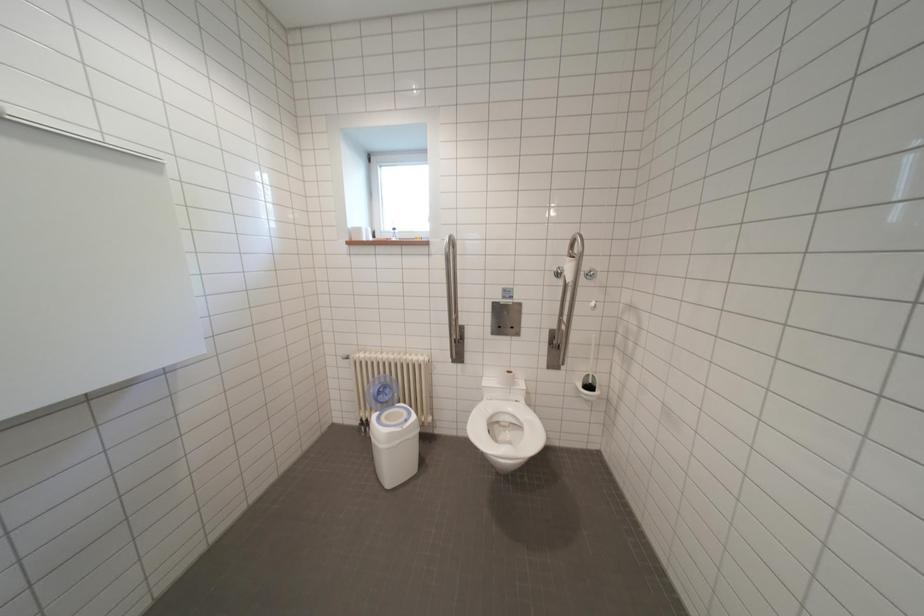
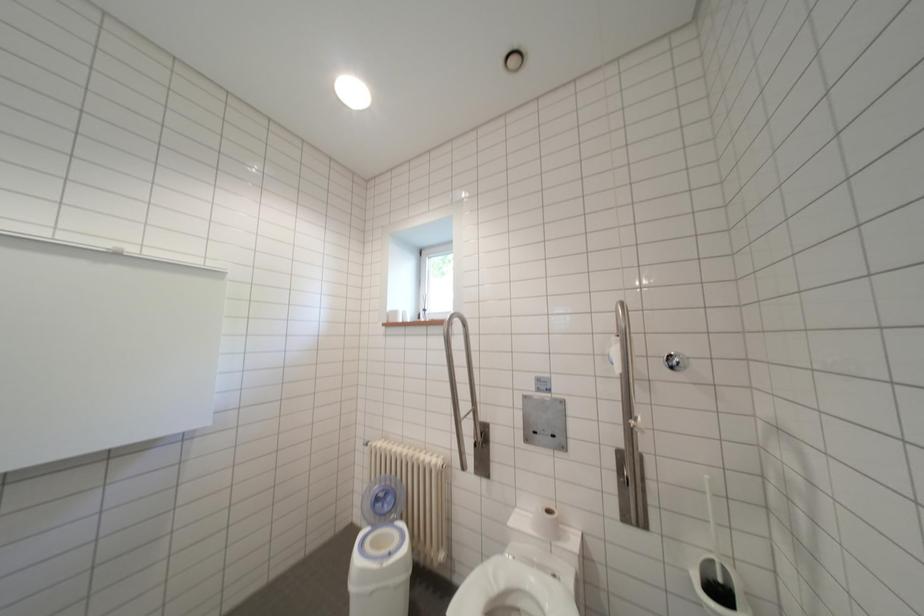
In a continuous first-person perspective shot, in which direction is the camera moving?

The cameraman walked toward right, forward.